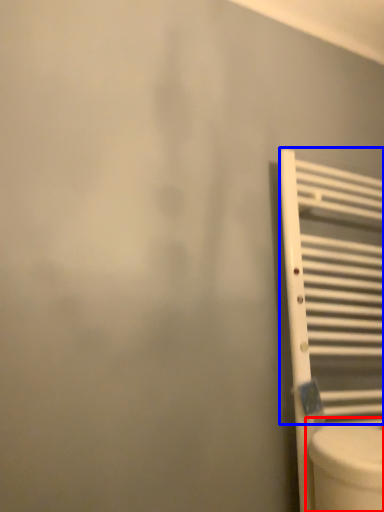
Question: Which of the following is the closest to the observer, toilet (highlighted by a red box) or radiator (highlighted by a blue box)?

Choices:
 (A) toilet
 (B) radiator

Answer: (A)